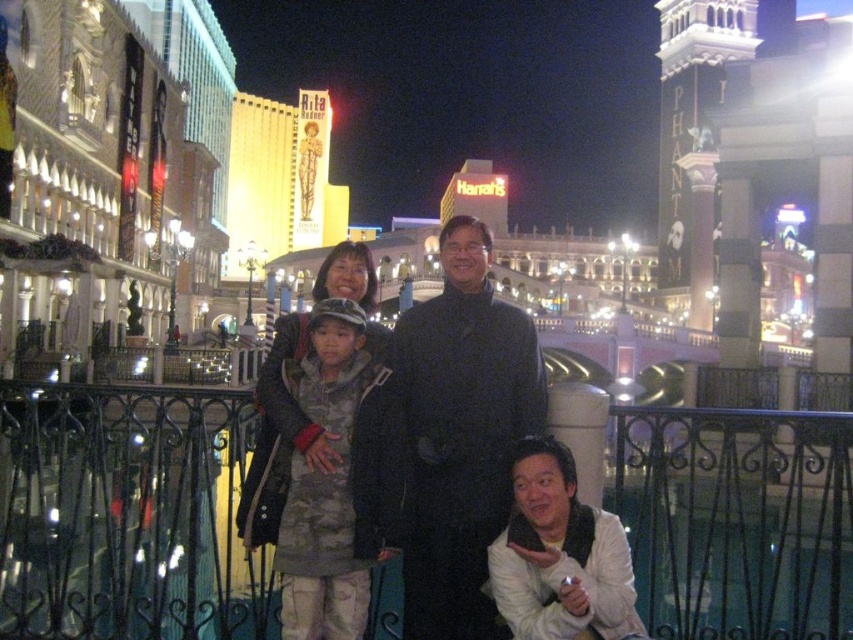
You are a photographer trying to capture a clear shot of both the black matte suit at center and the white matte jacket at lower right. Since you can only focus on one subject at a time, which one should you choose to ensure the other remains somewhat in focus?

The black matte suit at center is closer to the viewer than the white matte jacket at lower right. To keep both somewhat in focus, you should focus on the black matte suit at center since it is closer, and the depth of field might extend to the farther subject.

You are a photographer trying to capture the group photo at the Las Vegas strip. You notice the camouflage jacket at center and the black matte suit at center. Which one is blocking the view of the other?

The camouflage jacket at center is in front of the black matte suit at center, so it is blocking the view of the black matte suit at center.

You are a photographer at the Las Vegas strip. You need to capture a photo where the black matte suit at center and the white matte jacket at lower right are both clearly visible. Which object should you focus on first to ensure both are in frame?

Since the black matte suit at center is larger in size than the white matte jacket at lower right, you should focus on the black matte suit at center first as it requires more space in the frame to capture details, ensuring the smaller white matte jacket at lower right will also fit into the composition.